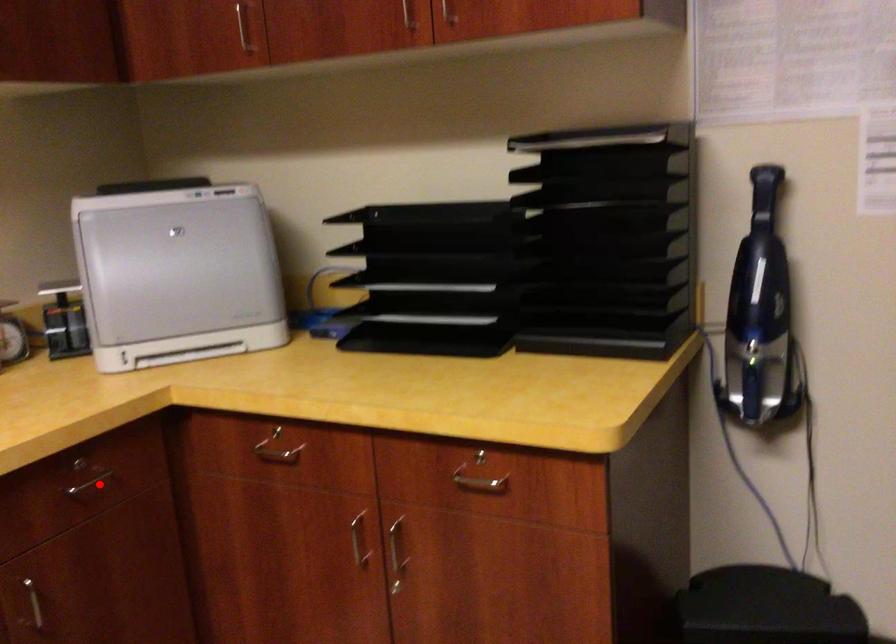
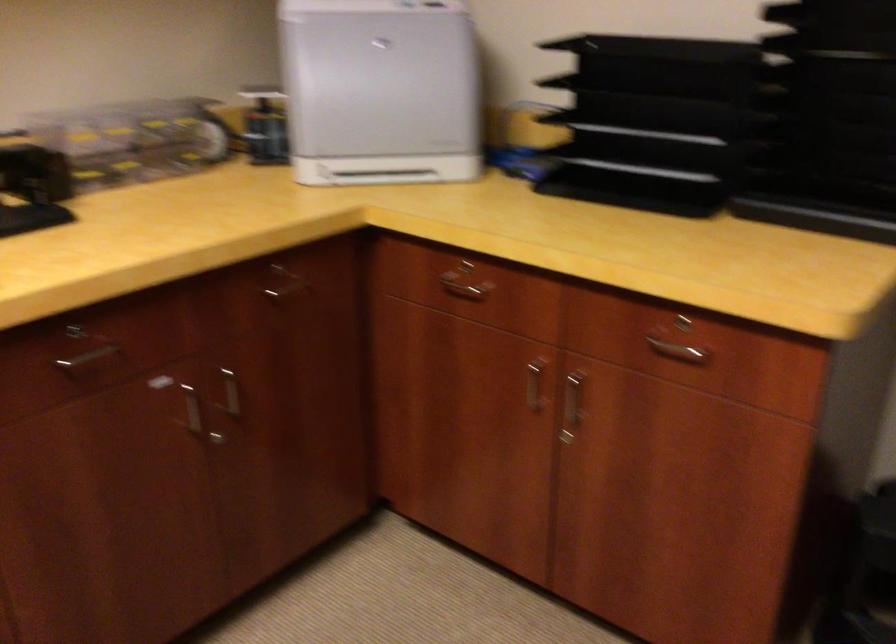
Locate, in the second image, the point that corresponds to the highlighted location in the first image.

(290, 294)